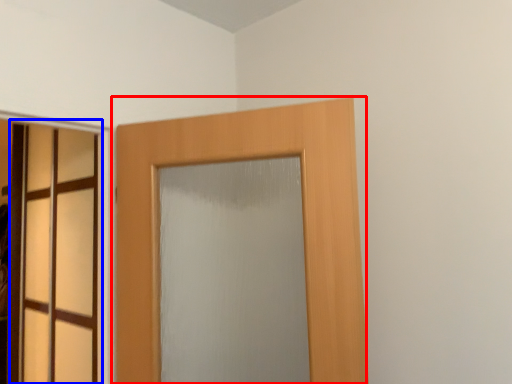
Question: Which point is closer to the camera, door (highlighted by a red box) or door (highlighted by a blue box)?

Choices:
 (A) door
 (B) door

Answer: (A)